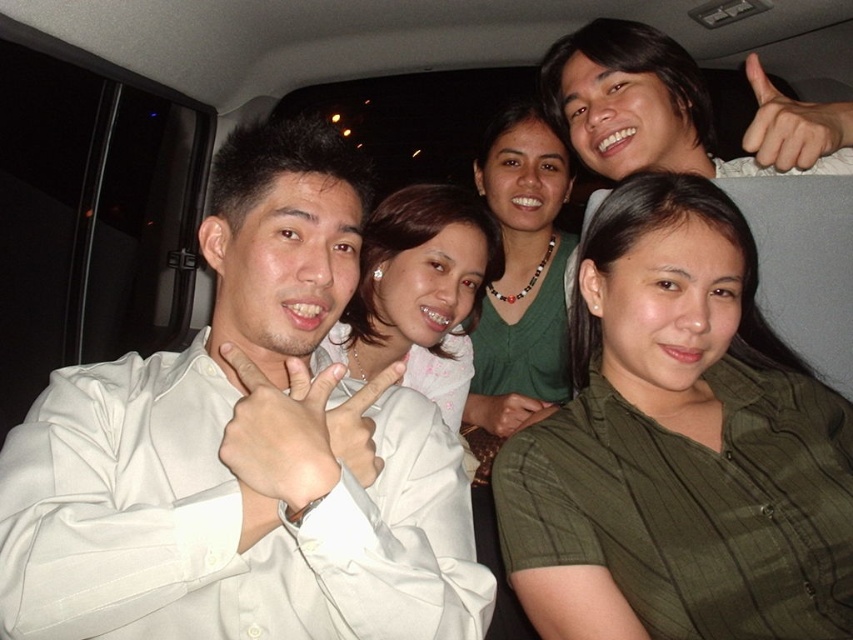
Question: Which point is farther to the camera?

Choices:
 (A) (331, 241)
 (B) (440, 344)
 (C) (779, 147)

Answer: (B)

Question: Which point is farther from the camera taking this photo?

Choices:
 (A) (387, 243)
 (B) (207, 554)

Answer: (A)

Question: Considering the real-world distances, which object is farthest from the green striped shirt at lower right?

Choices:
 (A) matte skin hand at upper right
 (B) green fabric shirt at center

Answer: (B)

Question: Is pink fabric at center bigger than matte skin hand at upper right?

Choices:
 (A) yes
 (B) no

Answer: (A)

Question: Does green striped shirt at lower right have a greater width compared to pink fabric at center?

Choices:
 (A) yes
 (B) no

Answer: (A)

Question: Does white satin shirt at left appear over pink fabric at center?

Choices:
 (A) yes
 (B) no

Answer: (B)